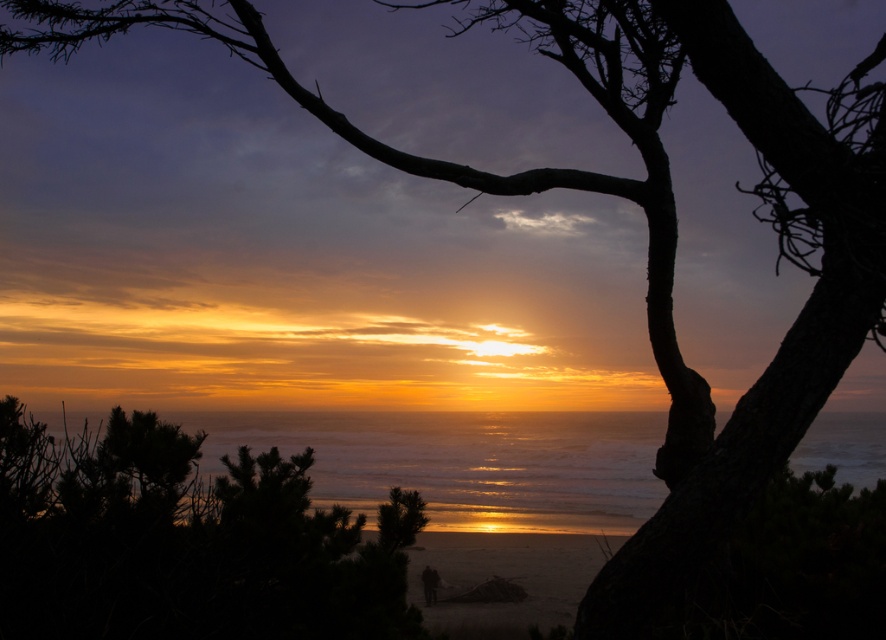
Question: Which object is closer to the camera taking this photo?

Choices:
 (A) shiny metallic water at center
 (B) green leafy tree at center

Answer: (B)

Question: Is green leafy tree at center closer to camera compared to shiny metallic water at center?

Choices:
 (A) yes
 (B) no

Answer: (A)

Question: Is green leafy tree at center to the left of shiny metallic water at center from the viewer's perspective?

Choices:
 (A) no
 (B) yes

Answer: (B)

Question: In this image, where is green leafy tree at center located relative to shiny metallic water at center?

Choices:
 (A) above
 (B) below

Answer: (A)